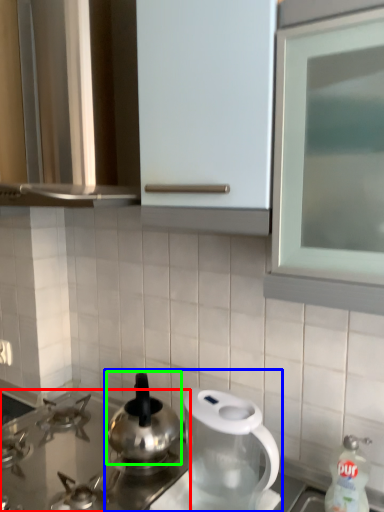
Question: Which is nearer to the gas stove (highlighted by a red box)? tea set (highlighted by a blue box) or kitchen appliance (highlighted by a green box).

Choices:
 (A) tea set
 (B) kitchen appliance

Answer: (B)